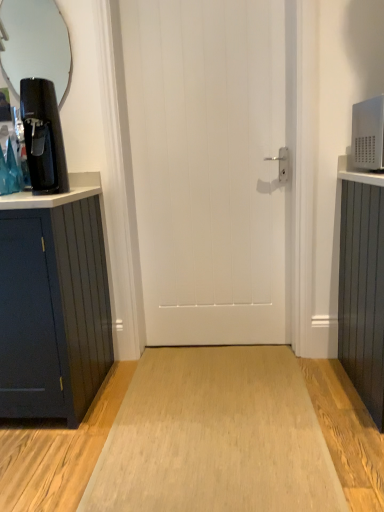
Question: From the image's perspective, is light wood floor at center located above or below white matte door at center?

Choices:
 (A) below
 (B) above

Answer: (A)

Question: Is light wood floor at center in front of or behind white matte door at center in the image?

Choices:
 (A) behind
 (B) front

Answer: (B)

Question: Based on their relative distances, which object is nearer to the light wood floor at center?

Choices:
 (A) white matte door at center
 (B) clear glass mirror at upper left
 (C) matte black coffee machine at left

Answer: (A)

Question: Estimate the real-world distances between objects in this image. Which object is farther from the white matte door at center?

Choices:
 (A) light wood floor at center
 (B) matte black coffee machine at left
 (C) clear glass mirror at upper left

Answer: (C)